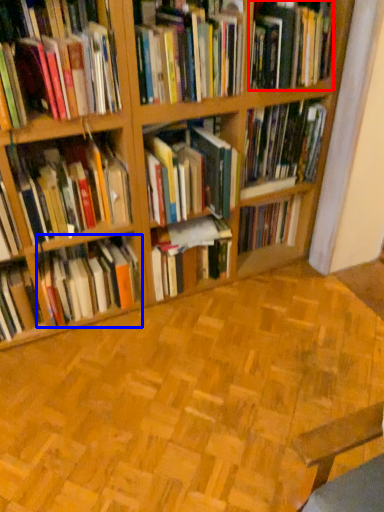
Question: Which object is closer to the camera taking this photo, book (highlighted by a red box) or book (highlighted by a blue box)?

Choices:
 (A) book
 (B) book

Answer: (A)